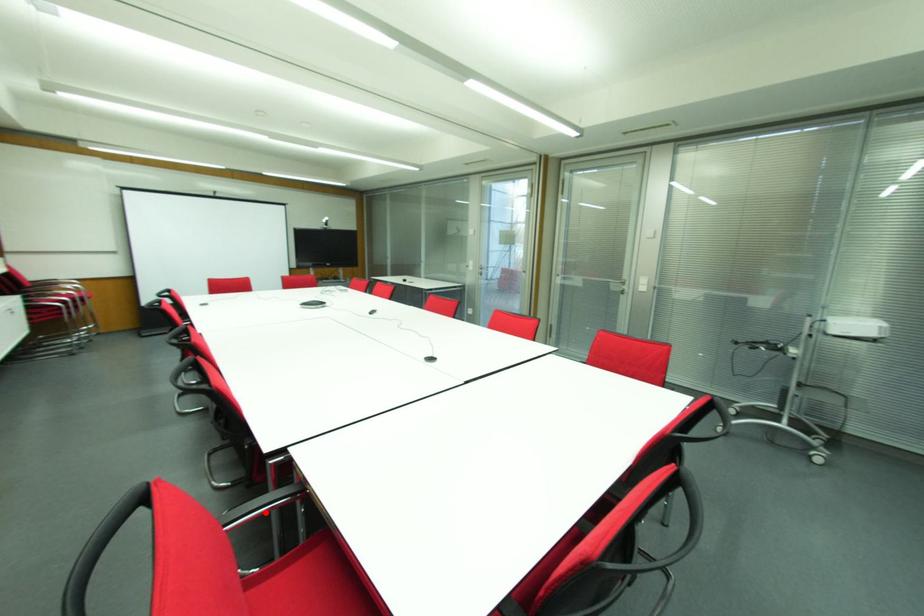
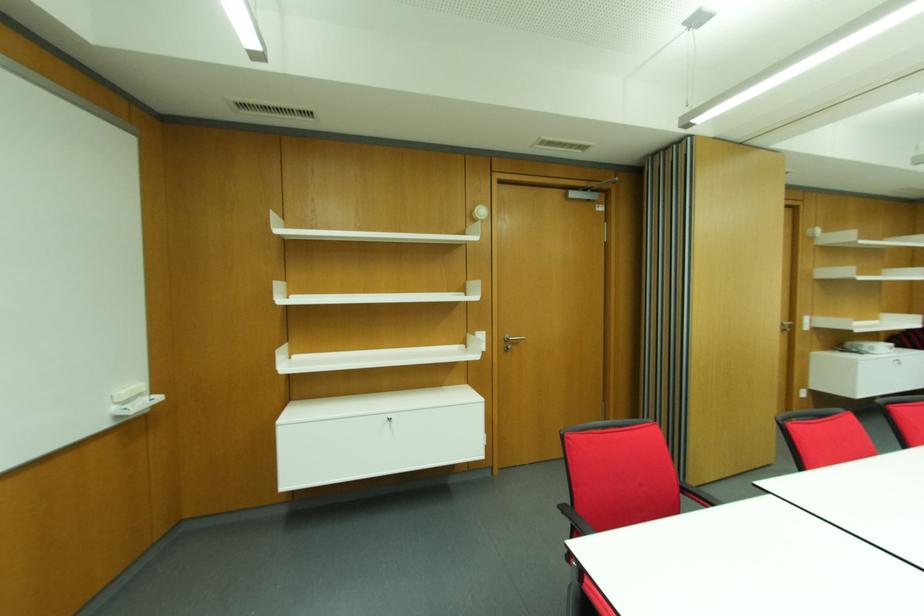
Question: I am providing you with two images of the same scene from different viewpoints. A red point is marked on the first image. At the location where the point appears in image 1, is it still visible in image 2?

Choices:
 (A) Yes
 (B) No

Answer: (B)